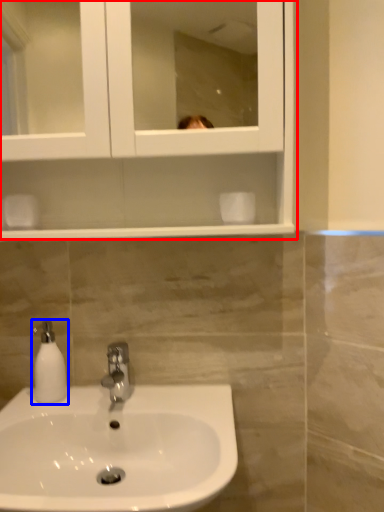
Question: Which of the following is the closest to the observer, medicine cabinet (highlighted by a red box) or soap dispenser (highlighted by a blue box)?

Choices:
 (A) medicine cabinet
 (B) soap dispenser

Answer: (A)